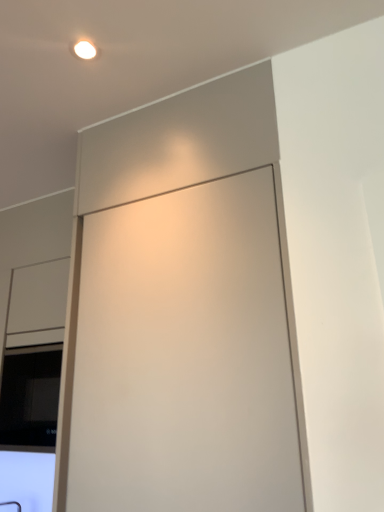
Question: From a real-world perspective, is matte white cabinet at center positioned above or below black glass window at lower left?

Choices:
 (A) above
 (B) below

Answer: (A)

Question: Is matte white cabinet at center wider or thinner than black glass window at lower left?

Choices:
 (A) thin
 (B) wide

Answer: (B)

Question: Is point (119, 330) positioned closer to the camera than point (31, 413)?

Choices:
 (A) closer
 (B) farther

Answer: (A)

Question: From a real-world perspective, is black glass window at lower left above or below matte white cabinet at center?

Choices:
 (A) above
 (B) below

Answer: (B)

Question: From the image's perspective, is black glass window at lower left above or below matte white cabinet at center?

Choices:
 (A) above
 (B) below

Answer: (B)

Question: From their relative heights in the image, would you say black glass window at lower left is taller or shorter than matte white cabinet at center?

Choices:
 (A) tall
 (B) short

Answer: (B)

Question: Would you say black glass window at lower left is inside or outside matte white cabinet at center?

Choices:
 (A) outside
 (B) inside

Answer: (A)